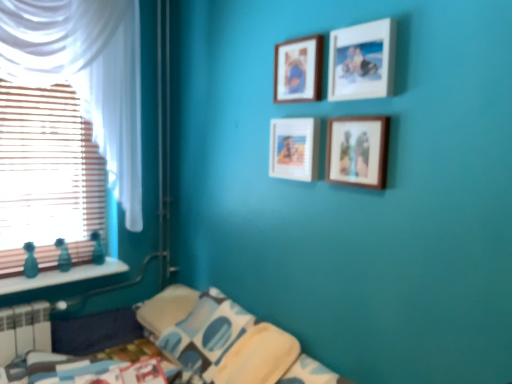
Image resolution: width=512 pixels, height=384 pixels. What do you see at coordinates (205, 333) in the screenshot?
I see `blue printed fabric pillow at lower center` at bounding box center [205, 333].

This screenshot has width=512, height=384. Find the location of `blue printed fabric pillow at lower center`. blue printed fabric pillow at lower center is located at coordinates (205, 333).

How much distance is there between wooden picture frame at upper center, the second picture frame viewed from the top, and wooden blinds at left?

wooden picture frame at upper center, the second picture frame viewed from the top, is 5.06 feet from wooden blinds at left.

Is wooden picture frame at upper center, the third picture frame in the bottom-to-top sequence, not inside wooden blinds at left?

Yes, wooden picture frame at upper center, the third picture frame in the bottom-to-top sequence, is not within wooden blinds at left.

Can you confirm if wooden picture frame at upper center, the second picture frame viewed from the top, is positioned to the left of wooden blinds at left?

No.

In the scene shown: Is the depth of wooden picture frame at upper center, the second picture frame viewed from the top, greater than that of wooden blinds at left?

No, it is not.

Is white plastic radiator at lower left smaller than wooden blinds at left?

Correct, white plastic radiator at lower left occupies less space than wooden blinds at left.

Is white plastic radiator at lower left taller or shorter than wooden blinds at left?

Considering their sizes, white plastic radiator at lower left has less height than wooden blinds at left.

Can you confirm if white plastic radiator at lower left is wider than wooden blinds at left?

Yes.

Relative to wooden blinds at left, is white plastic radiator at lower left in front or behind?

white plastic radiator at lower left is positioned closer to the viewer than wooden blinds at left.

Considering the positions of objects blue printed fabric pillow at lower center and wooden picture frame at upper center, the third picture frame in the bottom-to-top sequence, in the image provided, who is in front, blue printed fabric pillow at lower center or wooden picture frame at upper center, the third picture frame in the bottom-to-top sequence,?

wooden picture frame at upper center, the third picture frame in the bottom-to-top sequence, is more forward.

Is wooden picture frame at upper center, the third picture frame in the bottom-to-top sequence, at the back of blue printed fabric pillow at lower center?

That's not correct — blue printed fabric pillow at lower center is not looking away from wooden picture frame at upper center, the third picture frame in the bottom-to-top sequence.

Is point (220, 354) positioned behind point (371, 58)?

Yes, point (220, 354) is behind point (371, 58).

Is white sheer curtain at left surrounding matte wooden picture frame at center, which is the 2th picture frame in bottom-to-top order?

No, white sheer curtain at left does not contain matte wooden picture frame at center, which is the 2th picture frame in bottom-to-top order.

Which of these two, white sheer curtain at left or matte wooden picture frame at center, arranged as the 3th picture frame when viewed from the top, is smaller?

Smaller between the two is matte wooden picture frame at center, arranged as the 3th picture frame when viewed from the top.

At what (x,y) coordinates should I click in order to perform the action: click on curtain above the matte wooden picture frame at center, arranged as the 3th picture frame when viewed from the top (from a real-world perspective). Please return your answer as a coordinate pair (x, y). Looking at the image, I should click on (86, 74).

Which of these two, white sheer curtain at left or matte wooden picture frame at center, which is the 2th picture frame in bottom-to-top order, stands shorter?

matte wooden picture frame at center, which is the 2th picture frame in bottom-to-top order, is shorter.

Is white plastic radiator at lower left in front of wooden picture frame at upper center, the third picture frame in the bottom-to-top sequence?

No, it is behind wooden picture frame at upper center, the third picture frame in the bottom-to-top sequence.

From the image's perspective, does white plastic radiator at lower left appear lower than wooden picture frame at upper center, the third picture frame in the bottom-to-top sequence?

Yes, from the image's perspective, white plastic radiator at lower left is beneath wooden picture frame at upper center, the third picture frame in the bottom-to-top sequence.

Between white plastic radiator at lower left and wooden picture frame at upper center, the third picture frame in the bottom-to-top sequence, which one has less height?

wooden picture frame at upper center, the third picture frame in the bottom-to-top sequence.

Based on the photo, from a real-world perspective, is blue printed fabric pillow at lower center over white sheer curtain at left?

No, from a real-world perspective, blue printed fabric pillow at lower center is not above white sheer curtain at left.

Does blue printed fabric pillow at lower center have a greater height compared to white sheer curtain at left?

No, blue printed fabric pillow at lower center is not taller than white sheer curtain at left.

Which object is positioned more to the right, blue printed fabric pillow at lower center or white sheer curtain at left?

blue printed fabric pillow at lower center is more to the right.

Considering the sizes of objects teal glass bottles at left and wooden picture frame at upper center, the second picture frame viewed from the top, in the image provided, who is thinner, teal glass bottles at left or wooden picture frame at upper center, the second picture frame viewed from the top,?

wooden picture frame at upper center, the second picture frame viewed from the top, is thinner.

Is teal glass bottles at left to the left of wooden picture frame at upper center, the third picture frame in the bottom-to-top sequence, from the viewer's perspective?

Yes.

Is teal glass bottles at left outside of wooden picture frame at upper center, the third picture frame in the bottom-to-top sequence?

teal glass bottles at left lies outside wooden picture frame at upper center, the third picture frame in the bottom-to-top sequence,'s area.

From the image's perspective, is teal glass bottles at left under wooden picture frame at upper center, the third picture frame in the bottom-to-top sequence?

Indeed, from the image's perspective, teal glass bottles at left is shown beneath wooden picture frame at upper center, the third picture frame in the bottom-to-top sequence.

From the image's perspective, starting from the wooden blinds at left, which picture frame is the 3rd one above? Please provide its 2D coordinates.

[(362, 61)]

Where is `window that appears on the right of white plastic radiator at lower left`? This screenshot has width=512, height=384. window that appears on the right of white plastic radiator at lower left is located at coordinates (47, 177).

From the image, which object appears to be nearer to blue printed fabric pillow at lower center, teal glass bottles at left or white sheer curtain at left?

teal glass bottles at left lies closer to blue printed fabric pillow at lower center than the other object.

From the picture: When comparing their distances from teal glass bottles at left, does white plastic radiator at lower left or white sheer curtain at left seem further?

white sheer curtain at left lies further to teal glass bottles at left than the other object.

When comparing their distances from blue printed fabric pillow at lower center, does wooden picture frame at upper center, which is the first picture frame in top-to-bottom order, or wooden picture frame at upper center, the third picture frame in the bottom-to-top sequence, seem closer?

Among the two, wooden picture frame at upper center, which is the first picture frame in top-to-bottom order, is located nearer to blue printed fabric pillow at lower center.

Looking at the image, which one is located further to blue printed fabric pillow at lower center, white plastic radiator at lower left or wooden picture frame at upper center, the third picture frame in the bottom-to-top sequence?

wooden picture frame at upper center, the third picture frame in the bottom-to-top sequence, lies further to blue printed fabric pillow at lower center than the other object.

Based on the photo, looking at the image, which one is located further to white sheer curtain at left, matte wooden picture frame at center, which is the 2th picture frame in bottom-to-top order, or blue printed fabric pillow at lower center?

matte wooden picture frame at center, which is the 2th picture frame in bottom-to-top order, is positioned further to the anchor white sheer curtain at left.

Looking at this image, looking at the image, which one is located closer to white sheer curtain at left, wooden picture frame at upper center, the second picture frame viewed from the top, or white plastic radiator at lower left?

Based on the image, white plastic radiator at lower left appears to be nearer to white sheer curtain at left.

Estimate the real-world distances between objects in this image. Which object is further from wooden blinds at left, matte wooden picture frame at center, which is the 2th picture frame in bottom-to-top order, or wooden frame at center, marked as the first picture frame in a bottom-to-top arrangement?

The object further to wooden blinds at left is wooden frame at center, marked as the first picture frame in a bottom-to-top arrangement.

From the image, which object appears to be farther from wooden frame at center, marked as the first picture frame in a bottom-to-top arrangement, matte wooden picture frame at center, arranged as the 3th picture frame when viewed from the top, or white plastic radiator at lower left?

white plastic radiator at lower left is further to wooden frame at center, marked as the first picture frame in a bottom-to-top arrangement.

The width and height of the screenshot is (512, 384). Identify the location of curtain that lies between wooden picture frame at upper center, which is the first picture frame in top-to-bottom order, and blue printed fabric pillow at lower center from top to bottom. (86, 74).

Identify the location of window sill between wooden blinds at left and white plastic radiator at lower left from top to bottom. Image resolution: width=512 pixels, height=384 pixels. (62, 276).

You are a GUI agent. You are given a task and a screenshot of the screen. Output one action in this format:
    pyautogui.click(x=<x>, y=<y>)
    Task: Click on the window sill between wooden blinds at left and wooden picture frame at upper center, which is the first picture frame in top-to-bottom order, in the horizontal direction
    The image size is (512, 384).
    Given the screenshot: What is the action you would take?
    click(62, 276)

This screenshot has height=384, width=512. I want to click on curtain located between white plastic radiator at lower left and wooden picture frame at upper center, the second picture frame viewed from the top, in the left-right direction, so click(86, 74).